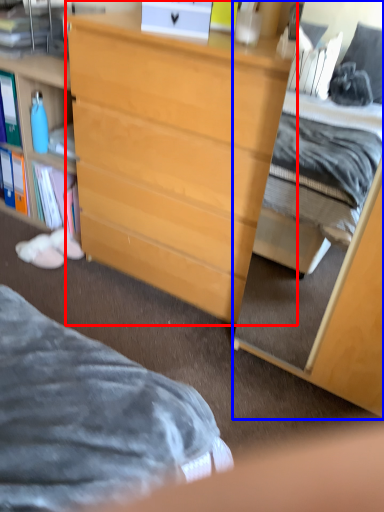
Question: Which point is further to the camera, desk (highlighted by a red box) or cabinetry (highlighted by a blue box)?

Choices:
 (A) desk
 (B) cabinetry

Answer: (A)